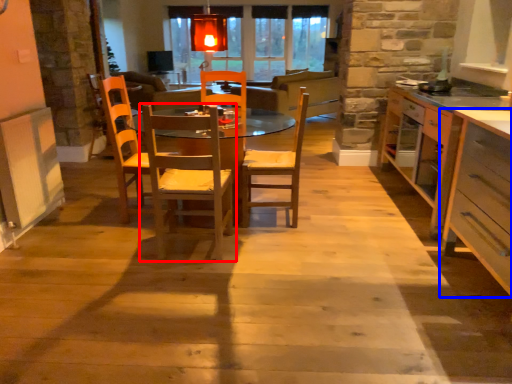
Question: Which object is further to the camera taking this photo, chair (highlighted by a red box) or cabinetry (highlighted by a blue box)?

Choices:
 (A) chair
 (B) cabinetry

Answer: (A)